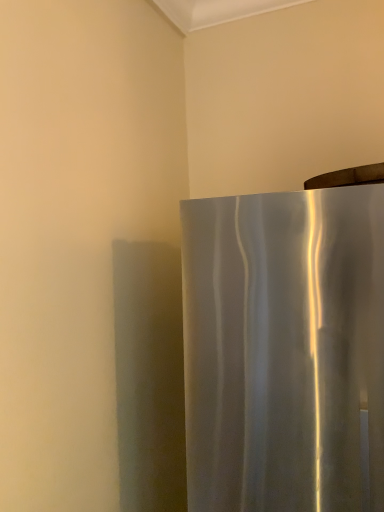
At what (x,y) coordinates should I click in order to perform the action: click on satin silver refrigerator at right. Please return your answer as a coordinate pair (x, y). Image resolution: width=384 pixels, height=512 pixels. Looking at the image, I should click on (283, 349).

Measure the distance between satin silver refrigerator at right and camera.

satin silver refrigerator at right and camera are 32.63 inches apart from each other.

Image resolution: width=384 pixels, height=512 pixels. What do you see at coordinates (283, 349) in the screenshot?
I see `satin silver refrigerator at right` at bounding box center [283, 349].

Where is `satin silver refrigerator at right`? The width and height of the screenshot is (384, 512). satin silver refrigerator at right is located at coordinates (283, 349).